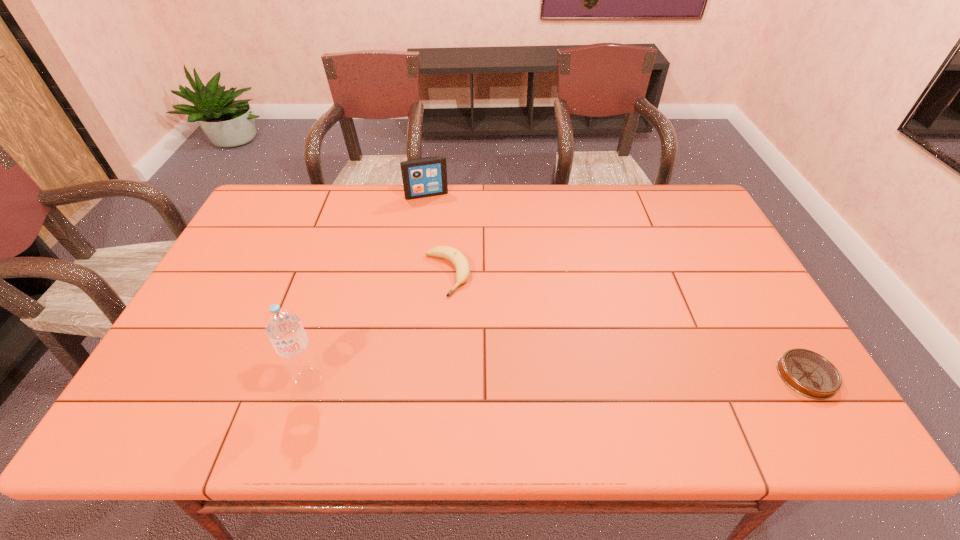
Find the location of a particular element. Image resolution: width=960 pixels, height=540 pixels. object at the near right corner is located at coordinates (808, 373).

Locate an element on the screen. free spot at the far edge of the desktop is located at coordinates (473, 189).

This screenshot has width=960, height=540. In the image, there is a desktop. In order to click on vacant space at the near edge in this screenshot , I will do `click(412, 366)`.

Find the location of a particular element. free region at the left edge of the desktop is located at coordinates (251, 242).

In the image, there is a desktop. What are the coordinates of `vacant space at the right edge` in the screenshot? It's located at (713, 274).

Where is `vacant space at the far left corner of the desktop`? This screenshot has height=540, width=960. vacant space at the far left corner of the desktop is located at coordinates (281, 194).

The width and height of the screenshot is (960, 540). I want to click on free space at the far right corner of the desktop, so click(704, 210).

Image resolution: width=960 pixels, height=540 pixels. I want to click on vacant space that is in between the third tallest object and the tallest object, so click(x=378, y=327).

Find the location of `free space between the tallest object and the iPod`. free space between the tallest object and the iPod is located at coordinates (368, 287).

In order to click on vacant region between the shortest object and the second shortest object in this screenshot , I will do `click(627, 325)`.